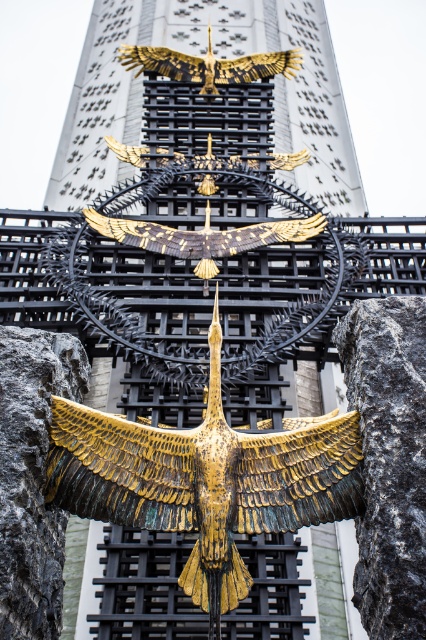
Does gold-bronze bird at center come in front of gold matte eagle at center?

Yes, gold-bronze bird at center is in front of gold matte eagle at center.

Between point (184, 440) and point (154, 234), which one is positioned in front?

Positioned in front is point (184, 440).

Identify the location of gold-bronze bird at center. (206, 481).

Measure the distance between gold-bronze bird at center and gold metallic eagle at upper center.

A distance of 48.96 meters exists between gold-bronze bird at center and gold metallic eagle at upper center.

Between point (201, 595) and point (158, 72), which one is positioned behind?

The point (158, 72) is behind.

What do you see at coordinates (206, 481) in the screenshot? I see `gold-bronze bird at center` at bounding box center [206, 481].

Locate an element on the screen. This screenshot has width=426, height=640. gold-bronze bird at center is located at coordinates (206, 481).

Is gold matte eagle at center in front of gold metallic eagle at upper center?

Yes, it is in front of gold metallic eagle at upper center.

Which is more to the right, gold matte eagle at center or gold metallic eagle at upper center?

Positioned to the right is gold metallic eagle at upper center.

The width and height of the screenshot is (426, 640). I want to click on gold matte eagle at center, so click(x=204, y=236).